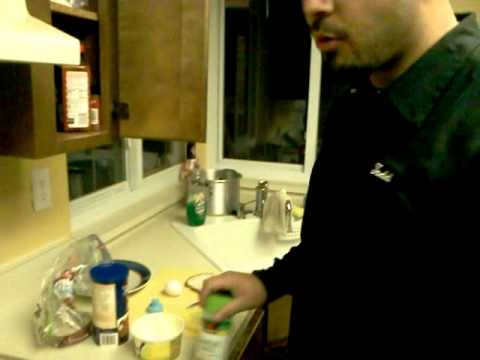
Locate an element on the screen. The height and width of the screenshot is (360, 480). seasoning jars is located at coordinates (216, 342), (106, 332), (108, 316), (76, 108).